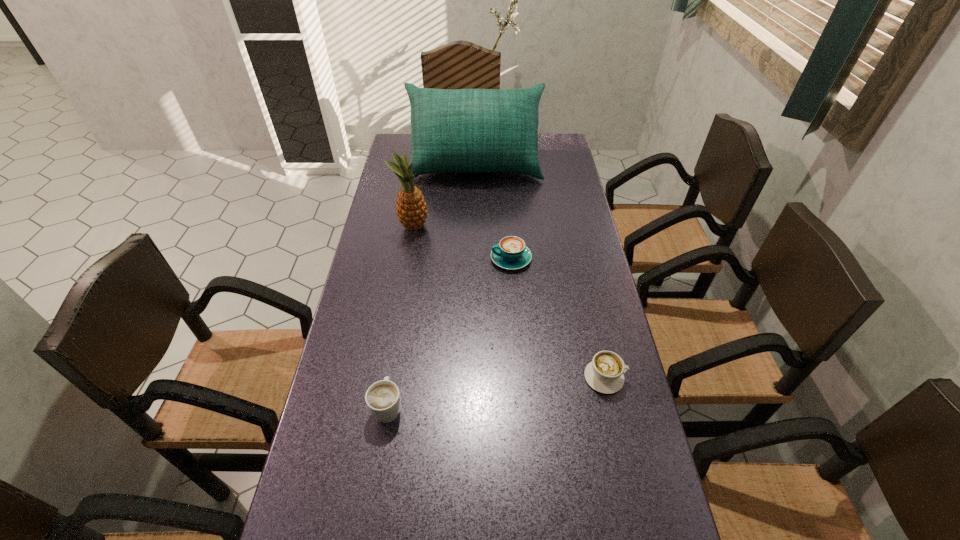
Locate an element on the screen. cappuccino that is at the right edge is located at coordinates (605, 373).

I want to click on object at the far left corner, so click(465, 130).

Where is `object present at the far right corner`? The image size is (960, 540). object present at the far right corner is located at coordinates (465, 130).

Find the location of a particular element. This screenshot has width=960, height=540. free region at the left edge is located at coordinates (375, 208).

Where is `free space at the right edge of the desktop`? The image size is (960, 540). free space at the right edge of the desktop is located at coordinates (592, 458).

This screenshot has height=540, width=960. In order to click on free space between the fourth nearest object and the cushion in this screenshot , I will do `click(444, 197)`.

Find the location of a particular element. unoccupied area between the third farthest object and the cushion is located at coordinates (493, 212).

Locate an element on the screen. The width and height of the screenshot is (960, 540). free spot between the rightmost object and the third shortest object is located at coordinates (496, 392).

At what (x,y) coordinates should I click in order to perform the action: click on vacant space that is in between the rightmost cappuccino and the third shortest object. Please return your answer as a coordinate pair (x, y). The width and height of the screenshot is (960, 540). Looking at the image, I should click on (496, 392).

Locate an element on the screen. The height and width of the screenshot is (540, 960). free space between the pineapple and the cushion is located at coordinates (444, 197).